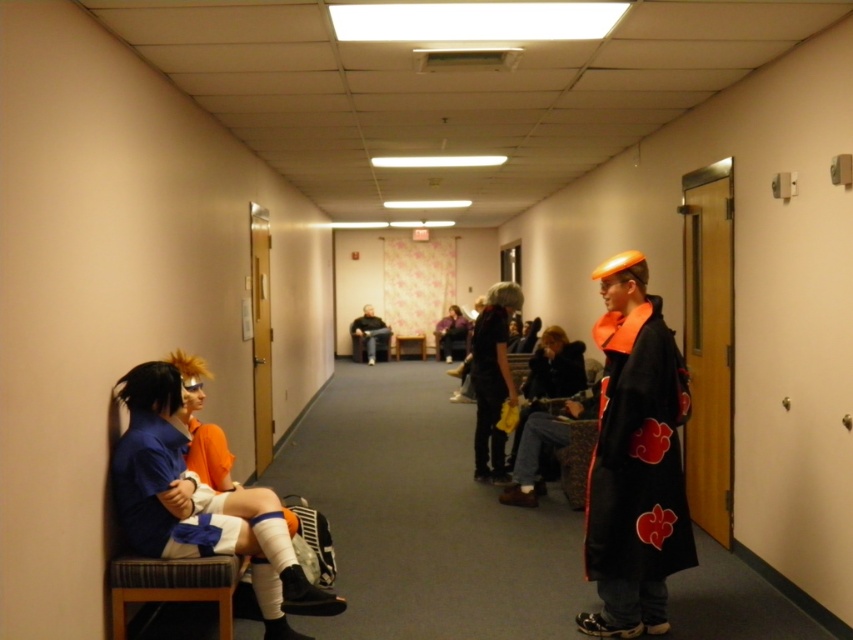
You are standing in the hallway and want to greet both the matte blue shirt at left and the dark brown leather jacket at center. Which one should you approach first if you want to start with the person closer to the entrance?

The matte blue shirt at left is to the left of the dark brown leather jacket at center, so if the entrance is on the left side of the hallway, you should approach the matte blue shirt at left first.

You are standing in the hallway and want to greet both the matte blue shirt at left and the dark brown leather jacket at center. Which person should you approach first to reach them in the shortest path?

You should approach the matte blue shirt at left first since it is in front of the dark brown leather jacket at center, making it closer to you.